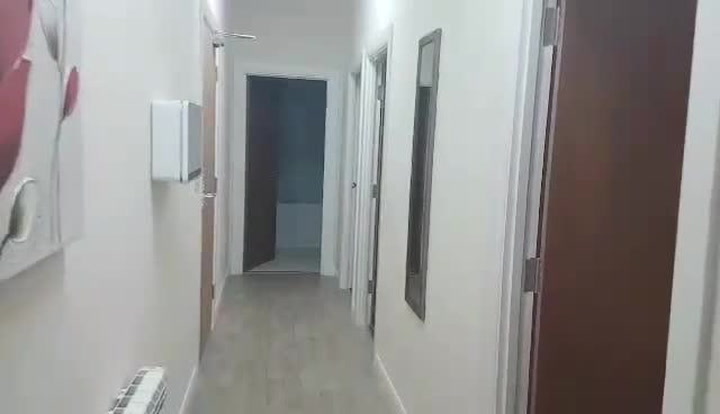
Locate an element on the screen. door handle is located at coordinates (209, 199).